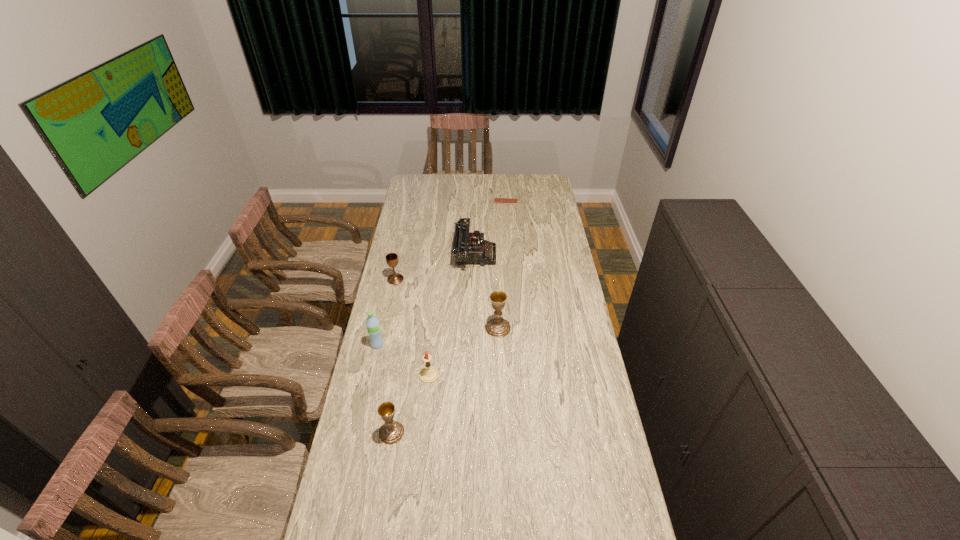
The image size is (960, 540). Find the location of `the nearest object`. the nearest object is located at coordinates (391, 432).

Identify the location of the fifth object from right to left. Image resolution: width=960 pixels, height=540 pixels. (391, 432).

You are a GUI agent. You are given a task and a screenshot of the screen. Output one action in this format:
    pyautogui.click(x=<x>, y=<y>)
    Task: Click on the fourth farthest object
    
    Given the screenshot: What is the action you would take?
    click(498, 327)

This screenshot has width=960, height=540. What are the coordinates of `the tallest chalice` in the screenshot? It's located at (498, 327).

Locate an element on the screen. Image resolution: width=960 pixels, height=540 pixels. the farthest chalice is located at coordinates 392,260.

You are a GUI agent. You are given a task and a screenshot of the screen. Output one action in this format:
    pyautogui.click(x=<x>, y=<y>)
    Task: Click on the typewriter
    
    Given the screenshot: What is the action you would take?
    pyautogui.click(x=468, y=247)

The image size is (960, 540). What are the coordinates of `the shortest object` in the screenshot? It's located at (496, 200).

The image size is (960, 540). I want to click on the farthest object, so pos(496,200).

This screenshot has height=540, width=960. Find the location of `the second nearest object`. the second nearest object is located at coordinates tap(429, 374).

The width and height of the screenshot is (960, 540). What are the coordinates of `the fourth object from left to right` in the screenshot? It's located at (429, 374).